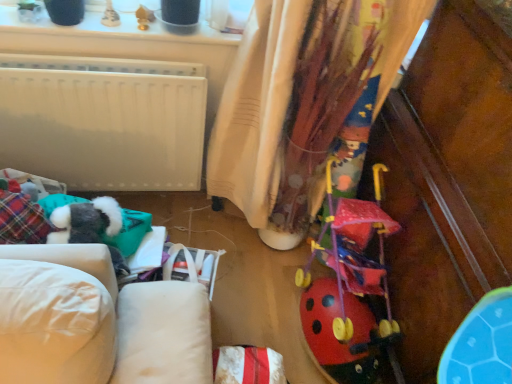
Question: Is there a large distance between textured beige curtain at center and rubberized red stroller at center-right?

Choices:
 (A) yes
 (B) no

Answer: (B)

Question: Would you say textured beige curtain at center is outside rubberized red stroller at center-right?

Choices:
 (A) no
 (B) yes

Answer: (B)

Question: Could you tell me if textured beige curtain at center is facing rubberized red stroller at center-right?

Choices:
 (A) no
 (B) yes

Answer: (B)

Question: Is rubberized red stroller at center-right completely or partially inside textured beige curtain at center?

Choices:
 (A) yes
 (B) no

Answer: (B)

Question: Does textured beige curtain at center come in front of rubberized red stroller at center-right?

Choices:
 (A) no
 (B) yes

Answer: (B)

Question: Does textured beige curtain at center have a lesser width compared to rubberized red stroller at center-right?

Choices:
 (A) no
 (B) yes

Answer: (B)

Question: Considering the relative sizes of rubberized red stroller at center-right and textured beige curtain at center in the image provided, is rubberized red stroller at center-right bigger than textured beige curtain at center?

Choices:
 (A) no
 (B) yes

Answer: (A)

Question: Is rubberized red stroller at center-right closer to camera compared to textured beige curtain at center?

Choices:
 (A) no
 (B) yes

Answer: (A)

Question: Considering the relative positions of rubberized red stroller at center-right and textured beige curtain at center in the image provided, is rubberized red stroller at center-right to the right of textured beige curtain at center from the viewer's perspective?

Choices:
 (A) yes
 (B) no

Answer: (A)

Question: Is rubberized red stroller at center-right aimed at textured beige curtain at center?

Choices:
 (A) no
 (B) yes

Answer: (A)

Question: Would you say rubberized red stroller at center-right contains textured beige curtain at center?

Choices:
 (A) no
 (B) yes

Answer: (A)

Question: Can you see rubberized red stroller at center-right touching textured beige curtain at center?

Choices:
 (A) yes
 (B) no

Answer: (B)

Question: From a real-world perspective, is textured beige curtain at center above or below rubberized red stroller at center-right?

Choices:
 (A) above
 (B) below

Answer: (A)